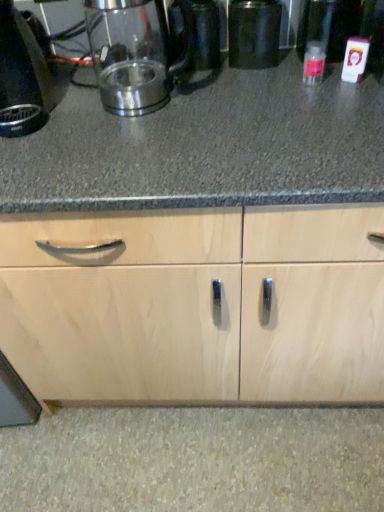
Question: Does metallic black canister at center contain clear plastic bottle at right?

Choices:
 (A) yes
 (B) no

Answer: (B)

Question: Does metallic black canister at center have a lesser width compared to clear plastic bottle at right?

Choices:
 (A) no
 (B) yes

Answer: (A)

Question: From the image's perspective, would you say metallic black canister at center is shown under clear plastic bottle at right?

Choices:
 (A) no
 (B) yes

Answer: (A)

Question: Is metallic black canister at center outside clear plastic bottle at right?

Choices:
 (A) no
 (B) yes

Answer: (B)

Question: From a real-world perspective, is metallic black canister at center physically below clear plastic bottle at right?

Choices:
 (A) yes
 (B) no

Answer: (B)

Question: In the image, is metallic black canister at center positioned in front of or behind clear plastic bottle at right?

Choices:
 (A) front
 (B) behind

Answer: (B)

Question: Is point (241, 27) closer or farther from the camera than point (309, 56)?

Choices:
 (A) farther
 (B) closer

Answer: (A)

Question: Looking at their shapes, would you say metallic black canister at center is wider or thinner than clear plastic bottle at right?

Choices:
 (A) thin
 (B) wide

Answer: (B)

Question: Considering the positions of metallic black canister at center and clear plastic bottle at right in the image, is metallic black canister at center bigger or smaller than clear plastic bottle at right?

Choices:
 (A) big
 (B) small

Answer: (A)

Question: Choose the correct answer: Is satin metallic kettle at upper left inside black plastic kettle at left or outside it?

Choices:
 (A) outside
 (B) inside

Answer: (A)

Question: Considering the positions of point (114, 102) and point (49, 81), is point (114, 102) closer or farther from the camera than point (49, 81)?

Choices:
 (A) farther
 (B) closer

Answer: (B)

Question: From a real-world perspective, is satin metallic kettle at upper left above or below black plastic kettle at left?

Choices:
 (A) below
 (B) above

Answer: (A)

Question: Is satin metallic kettle at upper left to the left or to the right of black plastic kettle at left in the image?

Choices:
 (A) right
 (B) left

Answer: (A)

Question: Looking at their shapes, would you say metallic black canister at center is wider or thinner than satin metallic kettle at upper left?

Choices:
 (A) wide
 (B) thin

Answer: (B)

Question: From their relative heights in the image, would you say metallic black canister at center is taller or shorter than satin metallic kettle at upper left?

Choices:
 (A) tall
 (B) short

Answer: (B)